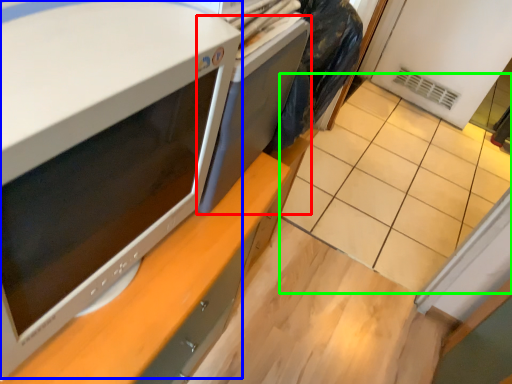
Question: Estimate the real-world distances between objects in this image. Which object is farther from desktop (highlighted by a red box), home appliance (highlighted by a blue box) or tile (highlighted by a green box)?

Choices:
 (A) home appliance
 (B) tile

Answer: (B)